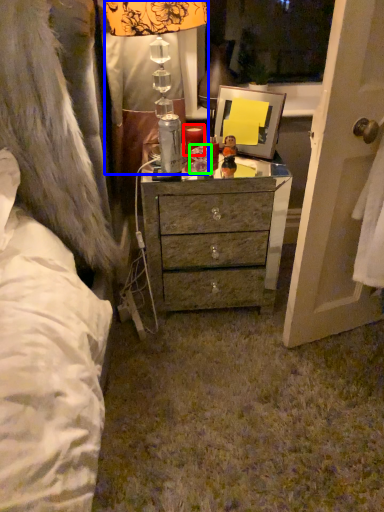
Question: Which is nearer to the candle (highlighted by a red box)? lamp (highlighted by a blue box) or toy (highlighted by a green box).

Choices:
 (A) lamp
 (B) toy

Answer: (B)